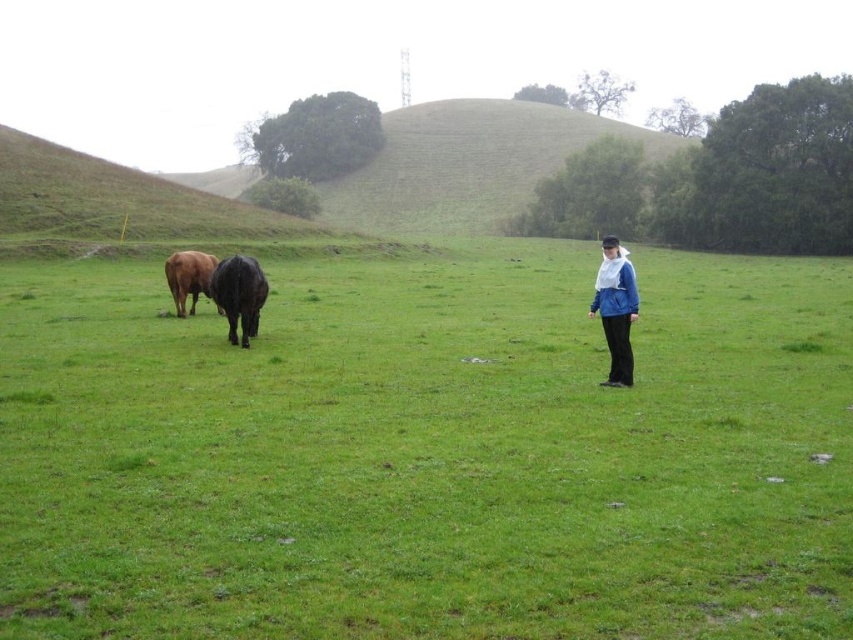
Is blue fabric jacket at right below brown matte cow at left?

Yes.

Does blue fabric jacket at right have a greater width compared to brown matte cow at left?

Incorrect, blue fabric jacket at right's width does not surpass brown matte cow at left's.

This screenshot has height=640, width=853. What are the coordinates of `blue fabric jacket at right` in the screenshot? It's located at (616, 308).

Who is more forward, (241, 320) or (181, 260)?

Positioned in front is point (241, 320).

The height and width of the screenshot is (640, 853). What do you see at coordinates (239, 296) in the screenshot?
I see `black matte cow at center` at bounding box center [239, 296].

Locate an element on the screen. black matte cow at center is located at coordinates (239, 296).

Who is higher up, blue fabric jacket at right or black matte cow at center?

Positioned higher is black matte cow at center.

Can you confirm if blue fabric jacket at right is wider than black matte cow at center?

No, blue fabric jacket at right is not wider than black matte cow at center.

Who is more distant from viewer, (624,353) or (238,342)?

Point (238,342)

Identify the location of blue fabric jacket at right. This screenshot has width=853, height=640. (616, 308).